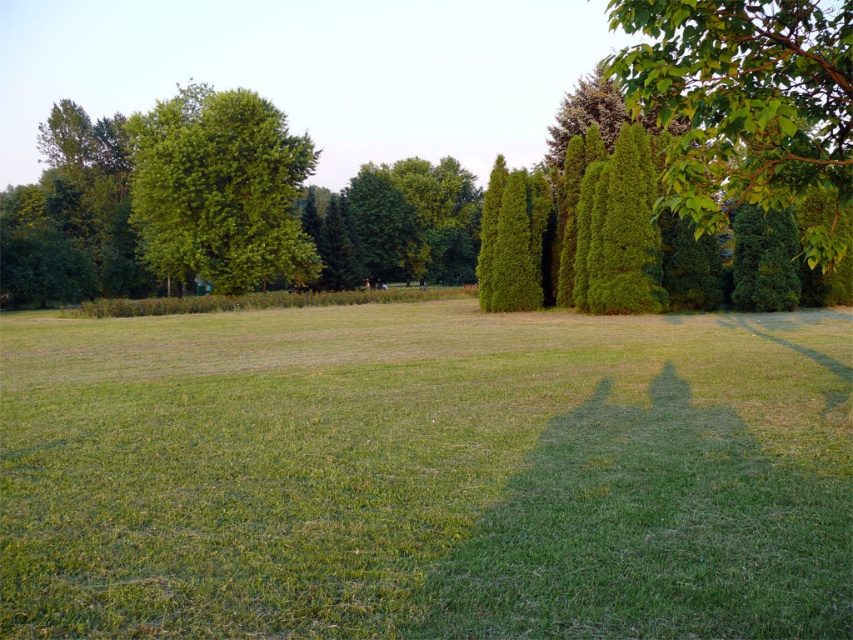
Which is above, green grass at center or green leafy tree at upper right?

green leafy tree at upper right is higher up.

The image size is (853, 640). Describe the element at coordinates (426, 474) in the screenshot. I see `green grass at center` at that location.

Between point (363, 520) and point (679, 17), which one is positioned behind?

The point (679, 17) is behind.

Find the location of `green grass at center`. green grass at center is located at coordinates (426, 474).

Who is lower down, green leafy tree at upper right or green leafy tree at upper left?

green leafy tree at upper left is below.

How distant is green leafy tree at upper right from green leafy tree at upper left?

green leafy tree at upper right and green leafy tree at upper left are 127.44 feet apart.

This screenshot has width=853, height=640. Identify the location of green leafy tree at upper right. (746, 104).

This screenshot has width=853, height=640. In order to click on green leafy tree at upper right in this screenshot , I will do `click(746, 104)`.

Looking at this image, is green grass at center positioned at the back of green leafy tree at upper left?

No, green grass at center is closer to the viewer.

Which is behind, point (13, 445) or point (286, 208)?

The point (286, 208) is more distant.

Which is in front, point (741, 385) or point (177, 221)?

Positioned in front is point (741, 385).

Locate an element on the screen. The height and width of the screenshot is (640, 853). green grass at center is located at coordinates (426, 474).